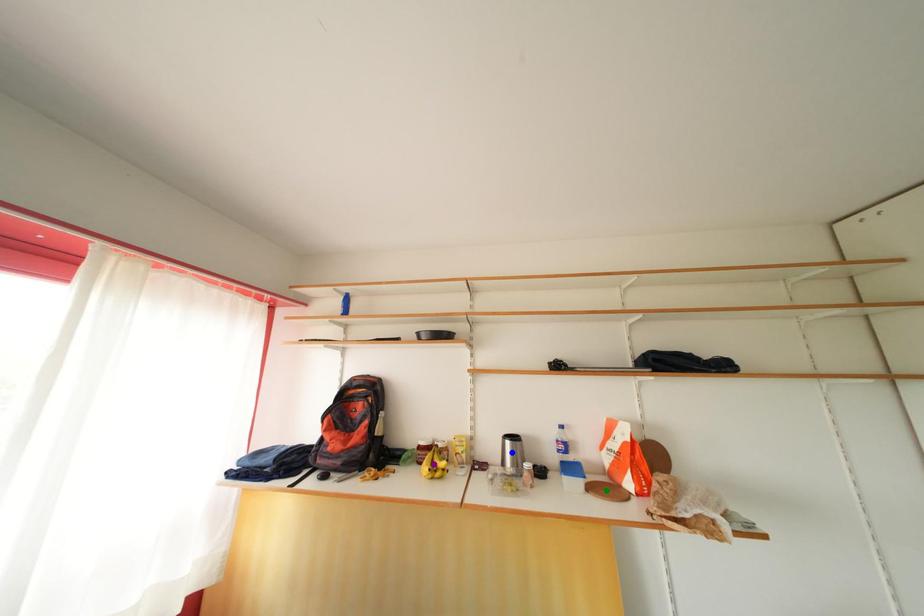
Order these from farthest to nearest:
green point
purple point
blue point

purple point → blue point → green point